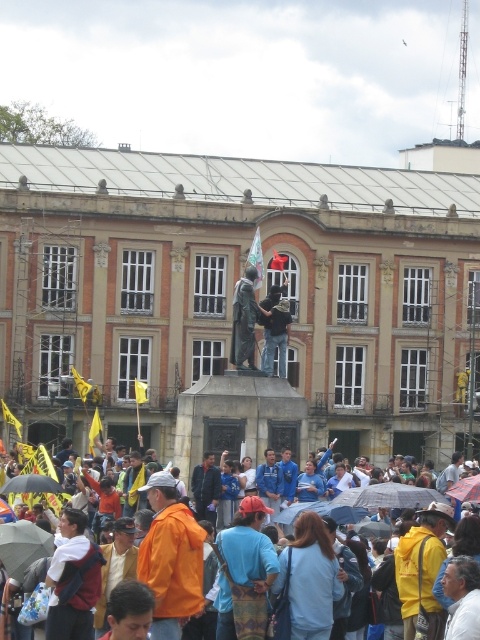
Question: Can you confirm if blue fabric crowd at center is positioned below matte bronze statue at center?

Choices:
 (A) yes
 (B) no

Answer: (A)

Question: Among these points, which one is farthest from the camera?

Choices:
 (A) (458, 497)
 (B) (271, 372)
 (C) (248, 276)

Answer: (C)

Question: Is blue fabric crowd at center bigger than transparent plastic umbrella at center?

Choices:
 (A) no
 (B) yes

Answer: (B)

Question: Which point appears farthest from the camera in this image?

Choices:
 (A) (236, 340)
 (B) (436, 561)
 (C) (285, 317)
 (D) (458, 490)

Answer: (C)

Question: Is matte bronze statue at center further to camera compared to transparent plastic umbrella at center?

Choices:
 (A) yes
 (B) no

Answer: (A)

Question: Which object is the closest to the transparent plastic umbrella at center?

Choices:
 (A) bronze statue at center
 (B) matte bronze statue at center
 (C) blue fabric crowd at center

Answer: (C)